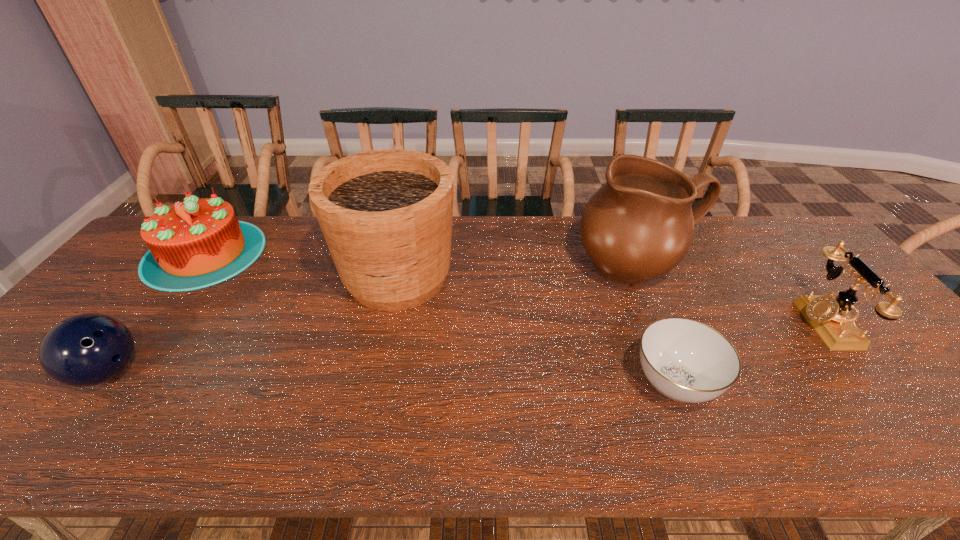
This screenshot has width=960, height=540. In order to click on vacant space that's between the telephone and the fifth tallest object in this screenshot , I will do `click(466, 348)`.

Locate an element on the screen. vacant region between the bowling ball and the cake is located at coordinates (156, 313).

At what (x,y) coordinates should I click in order to perform the action: click on vacant space that's between the rightmost object and the fifth tallest object. Please return your answer as a coordinate pair (x, y). The width and height of the screenshot is (960, 540). Looking at the image, I should click on (466, 348).

The image size is (960, 540). I want to click on vacant point located between the flowerpot and the bowling ball, so click(x=252, y=325).

Image resolution: width=960 pixels, height=540 pixels. I want to click on object identified as the third closest to the flowerpot, so click(85, 350).

Identify which object is the third closest to the flowerpot. Please provide its 2D coordinates. Your answer should be formatted as a tuple, i.e. [(x, y)], where the tuple contains the x and y coordinates of a point satisfying the conditions above.

[(85, 350)]

This screenshot has height=540, width=960. What are the coordinates of `vacant space that satisfies the following two spatial constraints: 1. on the front side of the third object from left to right; 2. on the left side of the shortest object` in the screenshot? It's located at (374, 383).

The width and height of the screenshot is (960, 540). What are the coordinates of `free location that satisfies the following two spatial constraints: 1. at the spout of the cream pitcher; 2. on the surface of the bowling ball near the finger holes` in the screenshot? It's located at (684, 372).

This screenshot has height=540, width=960. Identify the location of vacant space that satisfies the following two spatial constraints: 1. at the spout of the cream pitcher; 2. on the surface of the bowling ball near the finger holes. (684, 372).

Image resolution: width=960 pixels, height=540 pixels. I want to click on free space that satisfies the following two spatial constraints: 1. on the front side of the cake; 2. on the surface of the bowling ball near the finger holes, so click(x=113, y=372).